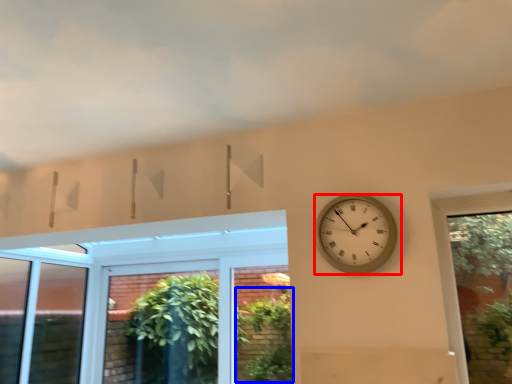
Question: Among these objects, which one is nearest to the camera, wall clock (highlighted by a red box) or plant (highlighted by a blue box)?

Choices:
 (A) wall clock
 (B) plant

Answer: (A)